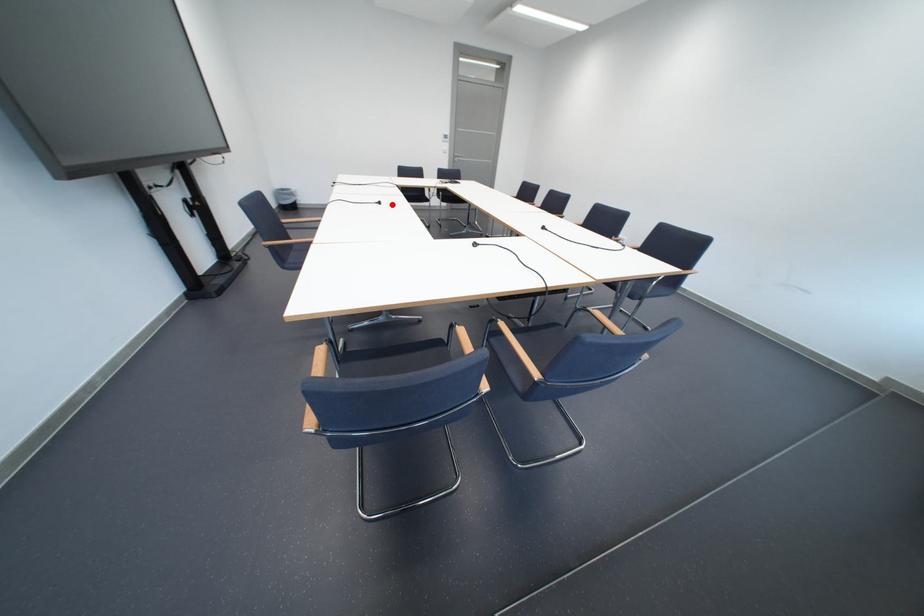
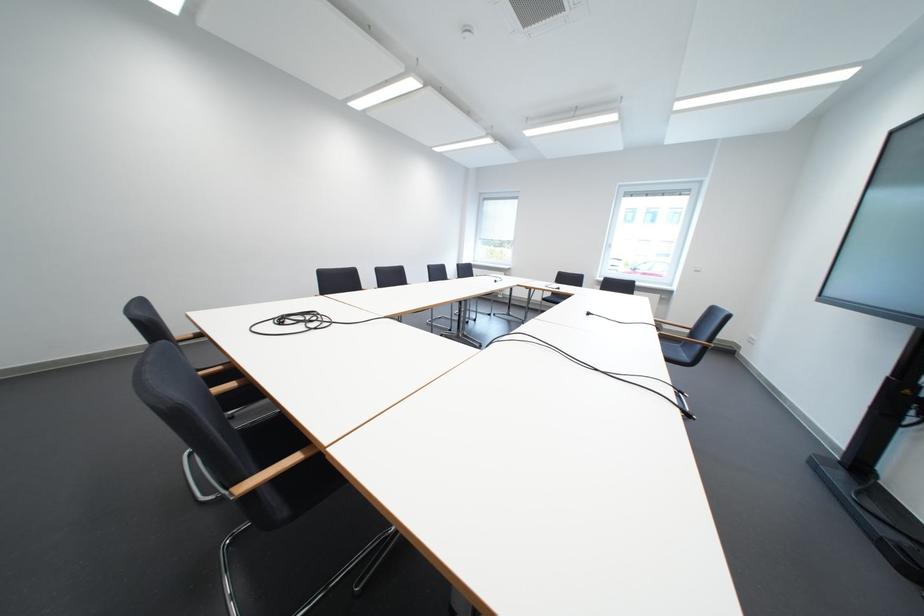
The point at the highlighted location is marked in the first image. Where is the corresponding point in the second image?

(601, 315)